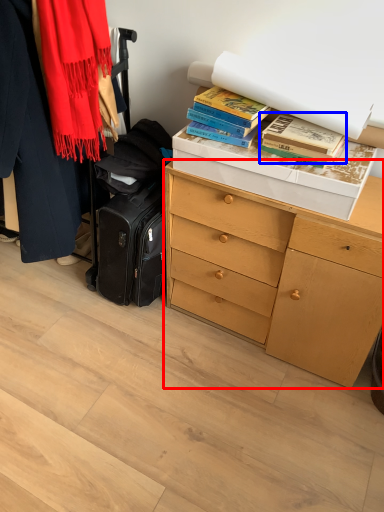
Question: Which object is closer to the camera taking this photo, chest of drawers (highlighted by a red box) or book (highlighted by a blue box)?

Choices:
 (A) chest of drawers
 (B) book

Answer: (A)